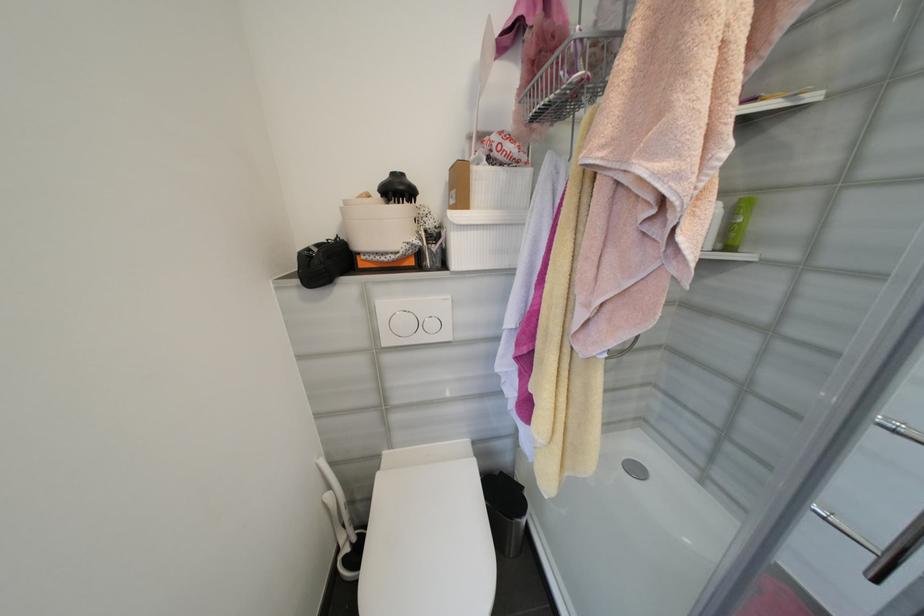
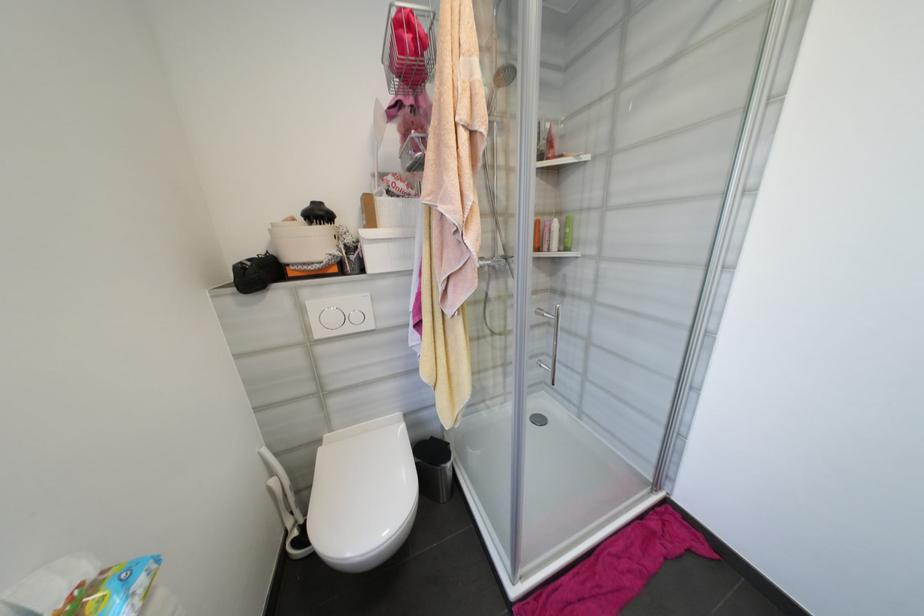
Where in the second image is the point corresponding to point 726,248 from the first image?

(567, 249)